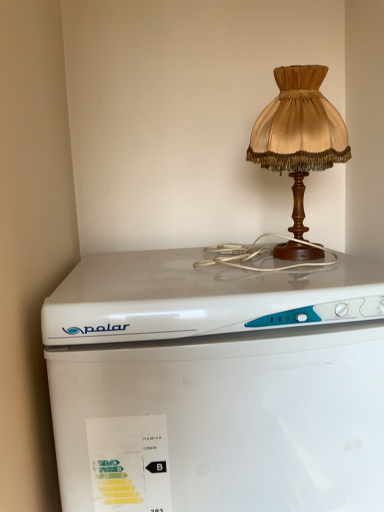
Question: From a real-world perspective, is satin gold lampshade at upper right below white plastic refrigerator at center?

Choices:
 (A) yes
 (B) no

Answer: (B)

Question: Does satin gold lampshade at upper right have a greater height compared to white plastic refrigerator at center?

Choices:
 (A) no
 (B) yes

Answer: (A)

Question: Is satin gold lampshade at upper right looking in the opposite direction of white plastic refrigerator at center?

Choices:
 (A) yes
 (B) no

Answer: (B)

Question: Is satin gold lampshade at upper right shorter than white plastic refrigerator at center?

Choices:
 (A) yes
 (B) no

Answer: (A)

Question: Does satin gold lampshade at upper right lie in front of white plastic refrigerator at center?

Choices:
 (A) yes
 (B) no

Answer: (B)

Question: Can you confirm if satin gold lampshade at upper right is smaller than white plastic refrigerator at center?

Choices:
 (A) no
 (B) yes

Answer: (B)

Question: Does white plastic refrigerator at center contain satin gold lampshade at upper right?

Choices:
 (A) yes
 (B) no

Answer: (B)

Question: Is white plastic refrigerator at center touching satin gold lampshade at upper right?

Choices:
 (A) yes
 (B) no

Answer: (B)

Question: Would you consider white plastic refrigerator at center to be distant from satin gold lampshade at upper right?

Choices:
 (A) no
 (B) yes

Answer: (A)

Question: From a real-world perspective, is white plastic refrigerator at center located higher than satin gold lampshade at upper right?

Choices:
 (A) yes
 (B) no

Answer: (B)

Question: From a real-world perspective, is white plastic refrigerator at center under satin gold lampshade at upper right?

Choices:
 (A) yes
 (B) no

Answer: (A)

Question: Can you confirm if white plastic refrigerator at center is wider than satin gold lampshade at upper right?

Choices:
 (A) no
 (B) yes

Answer: (B)

Question: Would you say white plastic refrigerator at center is inside or outside satin gold lampshade at upper right?

Choices:
 (A) inside
 (B) outside

Answer: (B)